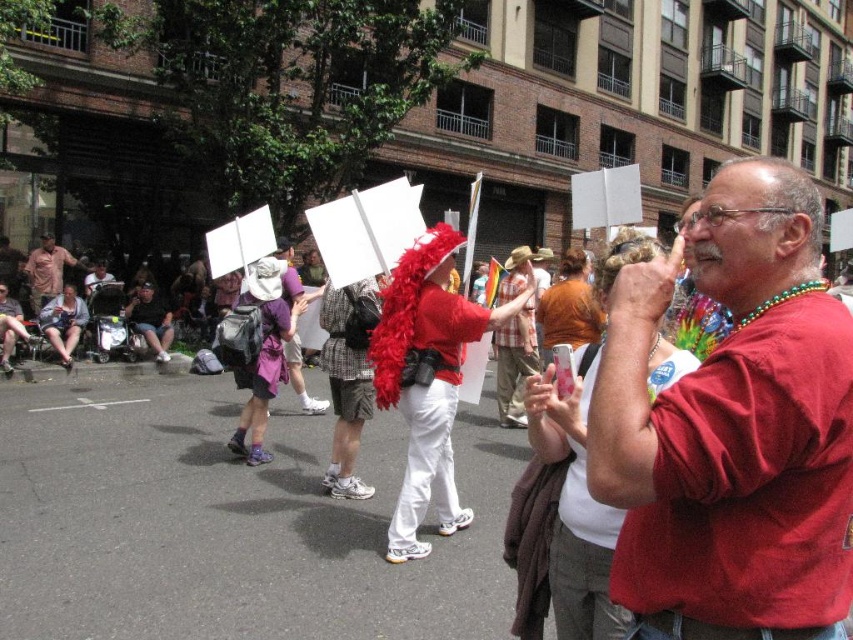
You are a photographer trying to capture a clear shot of both the matte red shirt at center and the purple fabric hat at center during the parade. Based on their positions, which one is blocking the view of the other?

The matte red shirt at center is blocking the view of the purple fabric hat at center because it is positioned in front of it.

You are a photographer standing at the edge of the street, wanting to capture both the feather boa at center and the matte pink shirt at center in a single frame. Your camera has a maximum focus range of 10 meters. Will you be able to fit both subjects into the shot without moving closer?

The distance between the feather boa at center and the matte pink shirt at center is 10.36 meters, which exceeds the camera maximum focus range of 10 meters. Therefore, you cannot fit both subjects into the shot without moving closer.